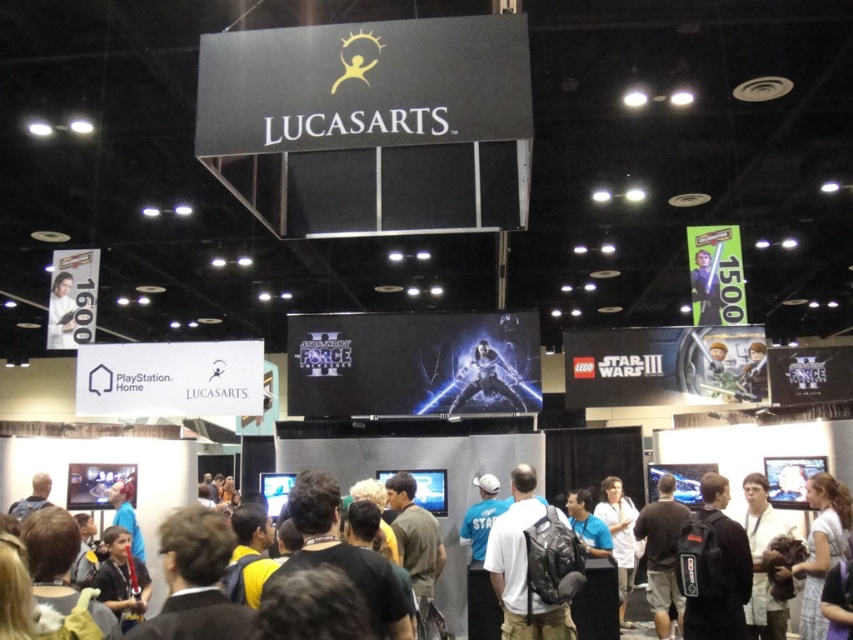
You are a photographer at the convention and want to capture both the black backpack at center and the white fabric shirt at center in a single frame. Which object should you position to the left side of your camera frame to ensure both are included?

To include both the black backpack at center and the white fabric shirt at center in your frame, position the black backpack at center on the left side of your camera frame since it is already on the left side of the white fabric shirt at center.

You are a convention attendee carrying a white matte backpack at center and want to place it near the white matte poster at upper left. Given that the convention hall has a 20 feet width, can you fit both items without exceeding the hall width?

The white matte backpack at center and white matte poster at upper left are 23.21 feet apart from each other, which exceeds the 20 feet width of the convention hall. Therefore, placing them together would not fit within the hall width.

You are standing at the entrance of the LucasArts expo hall. You see a white matte backpack at center. Where is the white matte backpack located in relation to the LucasArts logo displayed at the top center of the image?

The white matte backpack at center is located at point (532, 564) in 2D coordinates, which places it below the LucasArts logo at the top center.